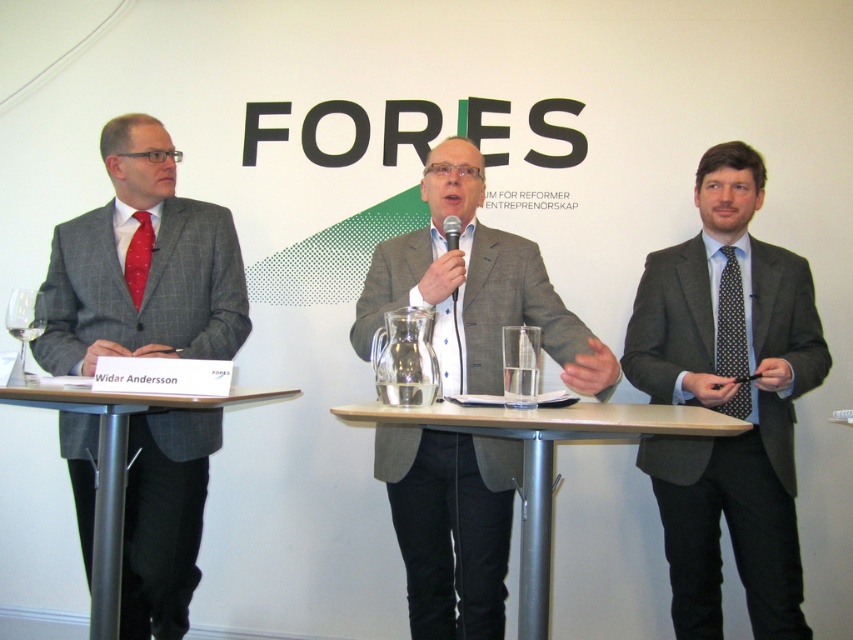
You are organizing a photo shoot and need to place two men wearing the matte gray suit at right and the matte gray suit at left in a row. If you want them to stand side by side with equal spacing between them and the edges of the frame, which man should be placed closer to the center to ensure the spacing looks balanced?

The matte gray suit at right should be placed closer to the center because it is wider than the matte gray suit at left. By positioning the wider suit near the center, the spacing between both suits and the frame edges will appear balanced.

You are attending a conference and need to locate the speaker who is positioned at the center of the stage. Which person is wearing the matte gray suit at center?

The matte gray suit at center is located at point (474, 285), so the speaker wearing the matte gray suit at center is positioned at the center of the stage.

You are a photographer at the event and want to take a picture of the matte gray suit at right. Where should you aim your camera?

You should aim your camera at point 0.625 on the x axis and 0.853 on the y axis to capture the matte gray suit at right.